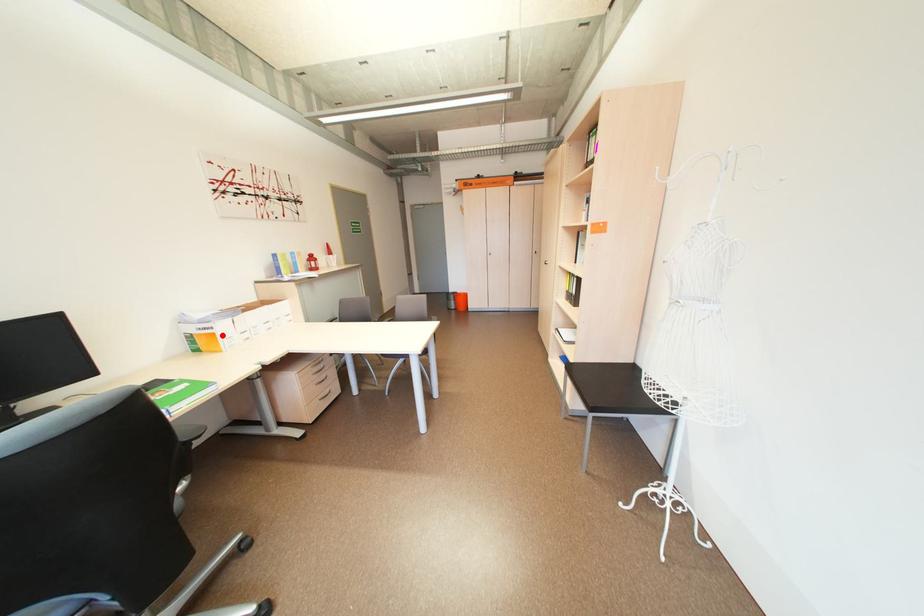
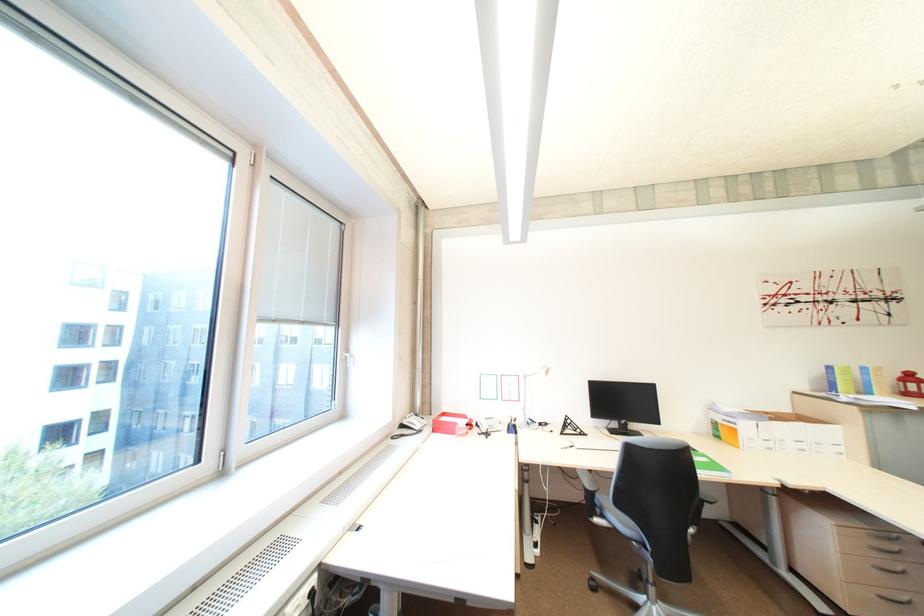
Where in the second image is the point corresponding to the highlighted location from the first image?

(745, 431)